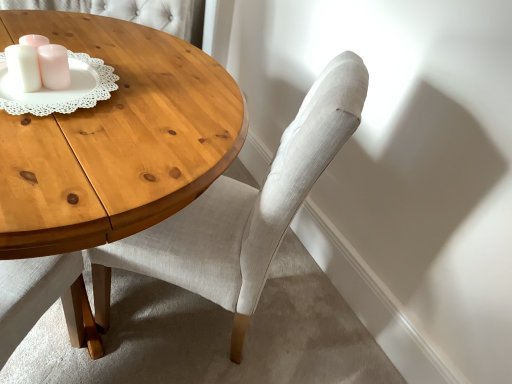
Measure the distance between point (65, 76) and camera.

Point (65, 76) and camera are 3.58 feet apart.

The height and width of the screenshot is (384, 512). Describe the element at coordinates (38, 64) in the screenshot. I see `white matte candle holder at upper left` at that location.

Identify the location of white matte candle holder at upper left. The height and width of the screenshot is (384, 512). (38, 64).

You are a GUI agent. You are given a task and a screenshot of the screen. Output one action in this format:
    pyautogui.click(x=<x>, y=<y>)
    Task: Click on the light gray fabric chair at center
    
    Given the screenshot: What is the action you would take?
    pyautogui.click(x=243, y=210)

Describe the element at coordinates (243, 210) in the screenshot. The width and height of the screenshot is (512, 384). I see `light gray fabric chair at center` at that location.

You are a GUI agent. You are given a task and a screenshot of the screen. Output one action in this format:
    pyautogui.click(x=<x>, y=<y>)
    Task: Click on the white matte candle holder at upper left
    The height and width of the screenshot is (384, 512).
    Given the screenshot: What is the action you would take?
    pyautogui.click(x=38, y=64)

In the image, is light gray fabric chair at center on the left side or the right side of white matte candle holder at upper left?

light gray fabric chair at center is to the right of white matte candle holder at upper left.

Which object is further away from the camera, light gray fabric chair at center or white matte candle holder at upper left?

white matte candle holder at upper left is further from the camera.

Considering the positions of point (213, 193) and point (70, 79), is point (213, 193) closer or farther from the camera than point (70, 79)?

Point (213, 193) is farther from the camera than point (70, 79).

From the image's perspective, between light gray fabric chair at center and white matte candle holder at upper left, which one is located above?

white matte candle holder at upper left.

From a real-world perspective, is light gray fabric chair at center over white matte candle holder at upper left?

No, from a real-world perspective, light gray fabric chair at center is not on top of white matte candle holder at upper left.

Between light gray fabric chair at center and white matte candle holder at upper left, which one has smaller width?

white matte candle holder at upper left.

Does light gray fabric chair at center have a lesser height compared to white matte candle holder at upper left?

No, light gray fabric chair at center is not shorter than white matte candle holder at upper left.

Is light gray fabric chair at center bigger than white matte candle holder at upper left?

Correct, light gray fabric chair at center is larger in size than white matte candle holder at upper left.

Is white matte candle holder at upper left inside light gray fabric chair at center?

No.

Is light gray fabric chair at center far from white matte candle holder at upper left?

light gray fabric chair at center is near white matte candle holder at upper left, not far away.

Is light gray fabric chair at center facing towards white matte candle holder at upper left?

Yes, light gray fabric chair at center is turned towards white matte candle holder at upper left.

How different are the orientations of light gray fabric chair at center and white matte candle holder at upper left in degrees?

28.8 degrees.

Measure the distance between light gray fabric chair at center and white matte candle holder at upper left.

light gray fabric chair at center is 23.09 inches from white matte candle holder at upper left.

You are a GUI agent. You are given a task and a screenshot of the screen. Output one action in this format:
    pyautogui.click(x=<x>, y=<y>)
    Task: Click on the chair below the white matte candle holder at upper left (from a real-world perspective)
    This screenshot has height=384, width=512.
    Given the screenshot: What is the action you would take?
    pyautogui.click(x=243, y=210)

Visually, is white matte candle holder at upper left positioned to the left or to the right of light gray fabric chair at center?

Clearly, white matte candle holder at upper left is on the left of light gray fabric chair at center in the image.

Relative to light gray fabric chair at center, is white matte candle holder at upper left in front or behind?

white matte candle holder at upper left is positioned farther from the viewer than light gray fabric chair at center.

Is point (29, 48) closer or farther from the camera than point (356, 77)?

Point (29, 48) is positioned farther from the camera compared to point (356, 77).

From the image's perspective, between white matte candle holder at upper left and light gray fabric chair at center, who is located below?

From the image's view, light gray fabric chair at center is below.

From a real-world perspective, is white matte candle holder at upper left physically below light gray fabric chair at center?

Incorrect, from a real-world perspective, white matte candle holder at upper left is higher than light gray fabric chair at center.

Can you confirm if white matte candle holder at upper left is wider than light gray fabric chair at center?

In fact, white matte candle holder at upper left might be narrower than light gray fabric chair at center.

Does white matte candle holder at upper left have a lesser height compared to light gray fabric chair at center?

Yes, white matte candle holder at upper left is shorter than light gray fabric chair at center.

Does white matte candle holder at upper left have a smaller size compared to light gray fabric chair at center?

Yes, white matte candle holder at upper left is smaller than light gray fabric chair at center.

Choose the correct answer: Is white matte candle holder at upper left inside light gray fabric chair at center or outside it?

white matte candle holder at upper left is located beyond the bounds of light gray fabric chair at center.

Is white matte candle holder at upper left touching light gray fabric chair at center?

No, white matte candle holder at upper left is not in contact with light gray fabric chair at center.

Is white matte candle holder at upper left oriented away from light gray fabric chair at center?

No, white matte candle holder at upper left is not facing the opposite direction of light gray fabric chair at center.

In the image, there is a light gray fabric chair at center. Where is `candle holder above it (from the image's perspective)`? Image resolution: width=512 pixels, height=384 pixels. candle holder above it (from the image's perspective) is located at coordinates (38, 64).

Locate an element on the screen. This screenshot has width=512, height=384. chair that appears below the white matte candle holder at upper left (from a real-world perspective) is located at coordinates (243, 210).

The width and height of the screenshot is (512, 384). I want to click on chair lying on the right of white matte candle holder at upper left, so click(x=243, y=210).